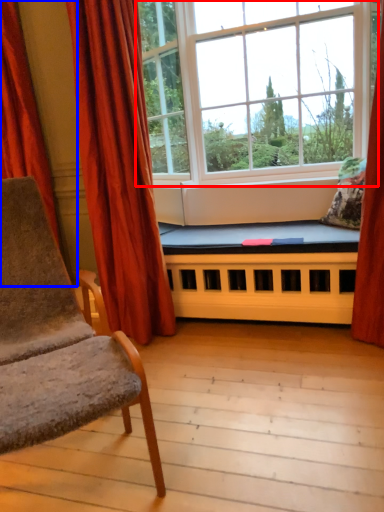
Question: Which object appears farthest to the camera in this image, window (highlighted by a red box) or curtain (highlighted by a blue box)?

Choices:
 (A) window
 (B) curtain

Answer: (B)